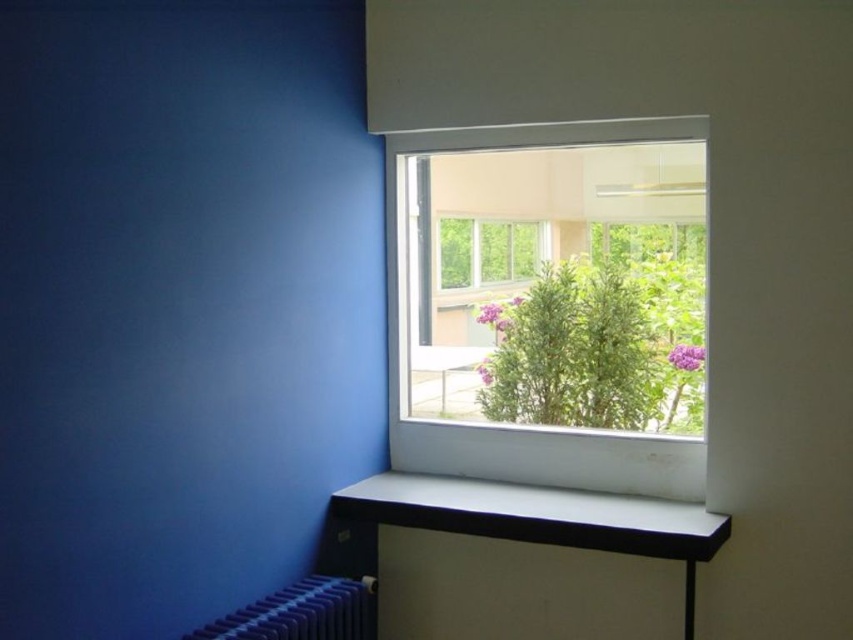
Is green leafy plant at center to the left of white plastic window at upper center from the viewer's perspective?

No, green leafy plant at center is not to the left of white plastic window at upper center.

Can you confirm if green leafy plant at center is positioned below white plastic window at upper center?

Yes.

Identify the location of green leafy plant at center. This screenshot has height=640, width=853. (x=596, y=346).

Is point (624, 412) closer to viewer compared to point (492, 504)?

No.

I want to click on green leafy plant at center, so click(596, 346).

Is white plastic window at upper center further to the viewer compared to white glossy window sill at lower center?

Yes, white plastic window at upper center is behind white glossy window sill at lower center.

Who is taller, white plastic window at upper center or white glossy window sill at lower center?

white plastic window at upper center

This screenshot has width=853, height=640. In order to click on white plastic window at upper center in this screenshot , I will do `click(525, 428)`.